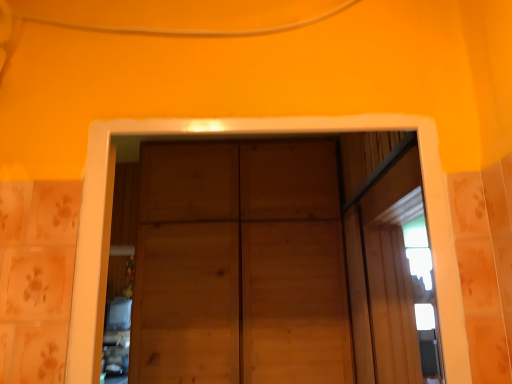
Question: Looking at their shapes, would you say natural wood door at center is wider or thinner than transparent glass window at center?

Choices:
 (A) wide
 (B) thin

Answer: (A)

Question: Choose the correct answer: Is natural wood door at center inside transparent glass window at center or outside it?

Choices:
 (A) inside
 (B) outside

Answer: (B)

Question: Visually, is natural wood door at center positioned to the left or to the right of transparent glass window at center?

Choices:
 (A) right
 (B) left

Answer: (B)

Question: From the image's perspective, relative to natural wood door at center, is transparent glass window at center above or below?

Choices:
 (A) below
 (B) above

Answer: (B)

Question: Relative to natural wood door at center, is transparent glass window at center in front or behind?

Choices:
 (A) front
 (B) behind

Answer: (A)

Question: Looking at their shapes, would you say transparent glass window at center is wider or thinner than natural wood door at center?

Choices:
 (A) thin
 (B) wide

Answer: (A)

Question: Considering the positions of point (410, 175) and point (185, 327), is point (410, 175) closer or farther from the camera than point (185, 327)?

Choices:
 (A) farther
 (B) closer

Answer: (B)